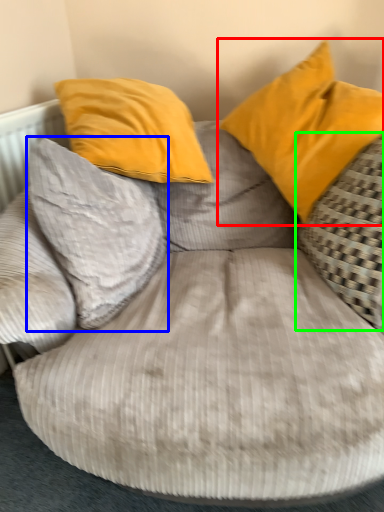
Question: Which object is the closest to the pillow (highlighted by a red box)? Choose among these: pillow (highlighted by a blue box) or pillow (highlighted by a green box).

Choices:
 (A) pillow
 (B) pillow

Answer: (B)